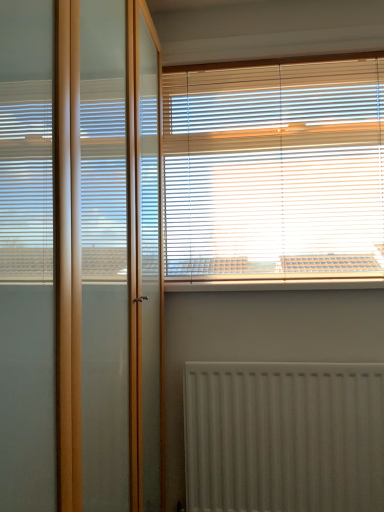
Question: Considering the relative sizes of white textured radiator at lower center and white plastic window sill at upper center in the image provided, is white textured radiator at lower center shorter than white plastic window sill at upper center?

Choices:
 (A) no
 (B) yes

Answer: (A)

Question: Is white plastic window sill at upper center inside white textured radiator at lower center?

Choices:
 (A) no
 (B) yes

Answer: (A)

Question: Is white textured radiator at lower center outside of white plastic window sill at upper center?

Choices:
 (A) yes
 (B) no

Answer: (A)

Question: From a real-world perspective, is white textured radiator at lower center located beneath white plastic window sill at upper center?

Choices:
 (A) no
 (B) yes

Answer: (B)

Question: Is the depth of white textured radiator at lower center greater than that of white plastic window sill at upper center?

Choices:
 (A) yes
 (B) no

Answer: (B)

Question: Can you confirm if white textured radiator at lower center is thinner than white plastic window sill at upper center?

Choices:
 (A) yes
 (B) no

Answer: (A)

Question: Considering the relative positions of white plastic window sill at upper center and white textured radiator at lower center in the image provided, is white plastic window sill at upper center in front of white textured radiator at lower center?

Choices:
 (A) no
 (B) yes

Answer: (A)

Question: Is white plastic window sill at upper center wider than white textured radiator at lower center?

Choices:
 (A) no
 (B) yes

Answer: (B)

Question: From the image's perspective, would you say white plastic window sill at upper center is shown under white textured radiator at lower center?

Choices:
 (A) yes
 (B) no

Answer: (B)

Question: Could you tell me if white plastic window sill at upper center is facing white textured radiator at lower center?

Choices:
 (A) yes
 (B) no

Answer: (B)

Question: Is white plastic window sill at upper center turned away from white textured radiator at lower center?

Choices:
 (A) no
 (B) yes

Answer: (A)

Question: Is white plastic window sill at upper center touching white textured radiator at lower center?

Choices:
 (A) yes
 (B) no

Answer: (B)

Question: Is white textured radiator at lower center thinner than transparent glass screen door at left?

Choices:
 (A) no
 (B) yes

Answer: (B)